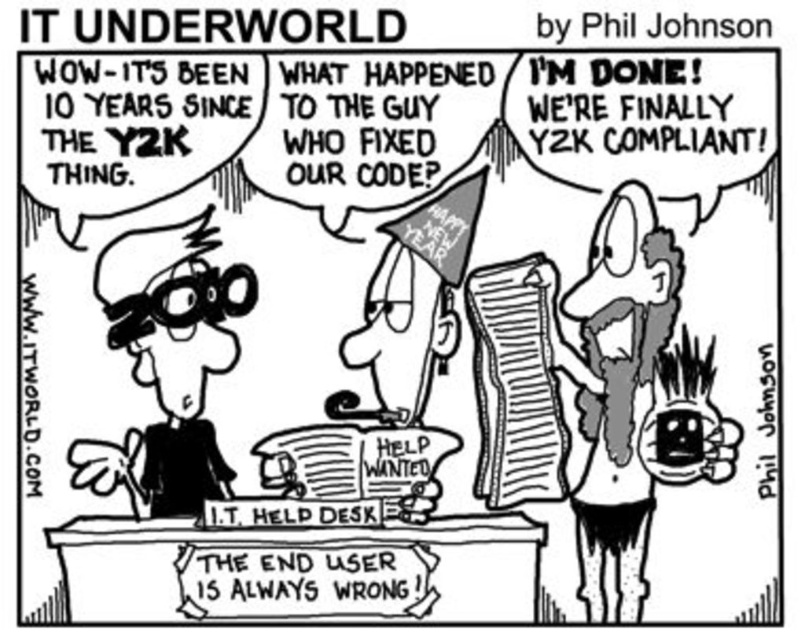
Based on the photo, does shaggy hair at right have a smaller size compared to matte black glasses at left?

Yes, shaggy hair at right is smaller than matte black glasses at left.

Is shaggy hair at right further to the viewer compared to matte black glasses at left?

Yes.

The width and height of the screenshot is (805, 640). I want to click on shaggy hair at right, so click(x=620, y=392).